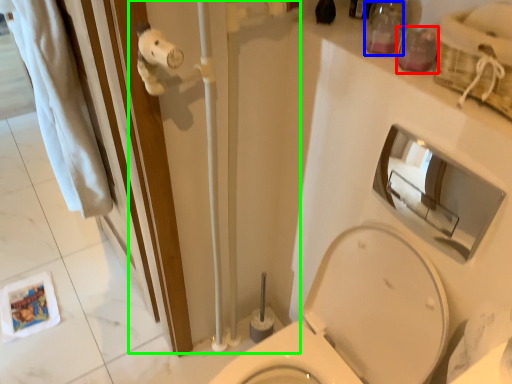
Question: Which is farther away from toiletry (highlighted by a red box)? toiletry (highlighted by a blue box) or shower door (highlighted by a green box)?

Choices:
 (A) toiletry
 (B) shower door

Answer: (B)